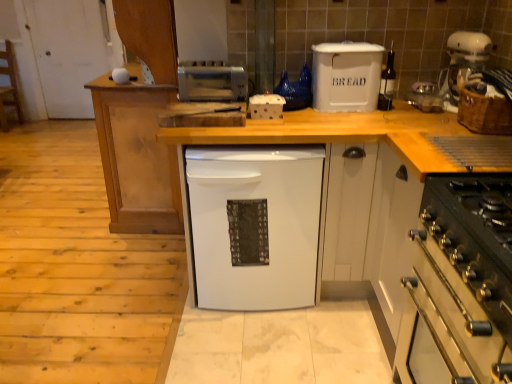
In order to click on spots to the right of matte white wine bottle at center, the second appliance when ordered from right to left in this screenshot , I will do `click(410, 113)`.